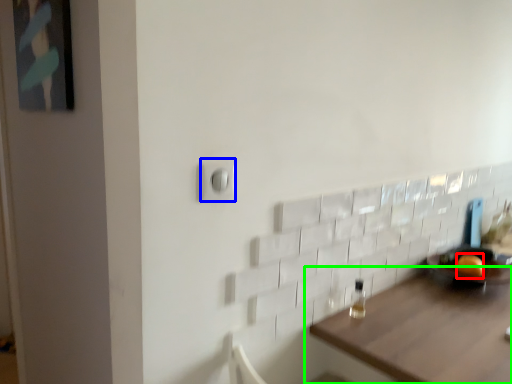
Question: Estimate the real-world distances between objects in this image. Which object is closer to orange (highlighted by a red box), light switch (highlighted by a blue box) or table (highlighted by a green box)?

Choices:
 (A) light switch
 (B) table

Answer: (B)